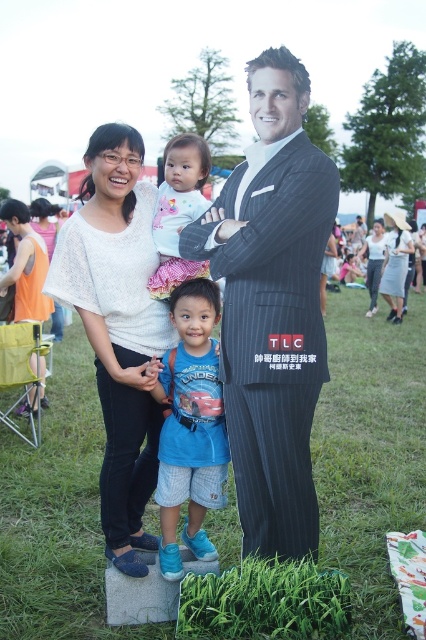
Question: Based on their relative distances, which object is farther from the white cotton onesie at center?

Choices:
 (A) white knitwear at center
 (B) gray textured dress at center
 (C) white cotton shirt at center
 (D) striped suit at center

Answer: (C)

Question: Observing the image, what is the correct spatial positioning of white cotton onesie at center in reference to white cotton dress at center?

Choices:
 (A) left
 (B) right

Answer: (A)

Question: Does white cotton onesie at center appear on the left side of white cotton shirt at center?

Choices:
 (A) no
 (B) yes

Answer: (B)

Question: Among these objects, which one is farthest from the camera?

Choices:
 (A) gray textured dress at center
 (B) white knitwear at center

Answer: (A)

Question: Based on their relative distances, which object is nearer to the gray textured dress at center?

Choices:
 (A) white knitwear at center
 (B) white cotton dress at center
 (C) striped suit at center
 (D) blue cotton shirt at center

Answer: (B)

Question: Can you confirm if striped suit at center is smaller than white cotton shirt at center?

Choices:
 (A) yes
 (B) no

Answer: (A)